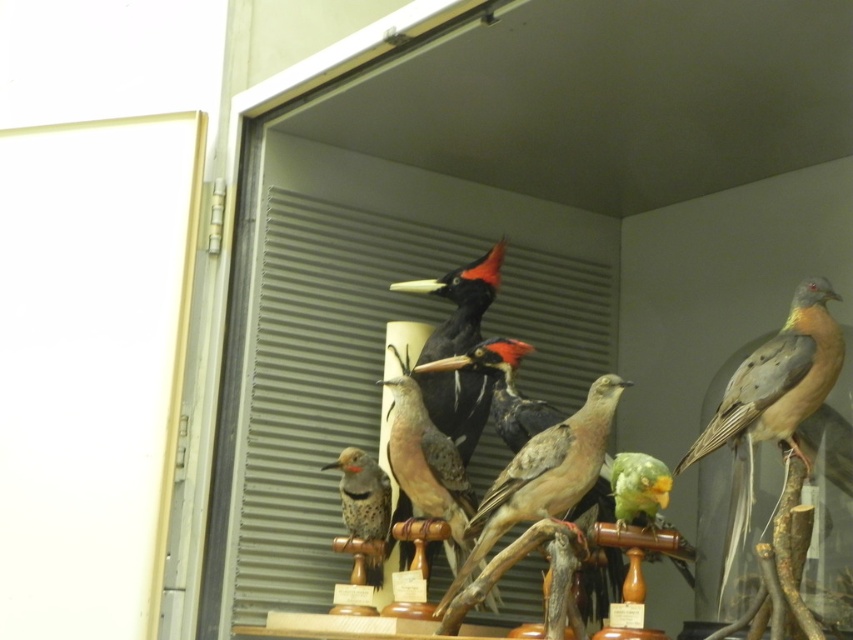
You are a museum visitor standing in front of the glass case. You want to take a photo of the brown matte bird at right. Where should you position your camera to capture it best?

The brown matte bird at right is located at the coordinates 0.613 on the x axis and 0.910 on the y axis within the glass case. To capture it best, position your camera so that it is centered on these coordinates.

You are a visitor standing in front of the glass case with taxidermied birds. You notice two points inside the case labeled as point 1 at coordinates point (457, 376) and point 2 at coordinates point (386, 486). Which point is closer to you?

Point (457, 376) is closer to you because it is further to the viewer than point (386, 486).

You are a museum curator trying to rearrange the birds in the glass case. You need to place a new bird specimen exactly halfway between the black matte woodpecker at center and the matte brown woodpecker at center. What is the minimum distance in centimeters you should place the new bird from each of the existing woodpeckers?

The distance between the black matte woodpecker at center and the matte brown woodpecker at center is 26.81 centimeters. To place the new bird halfway between them, it should be positioned 13.405 centimeters away from each existing woodpecker.